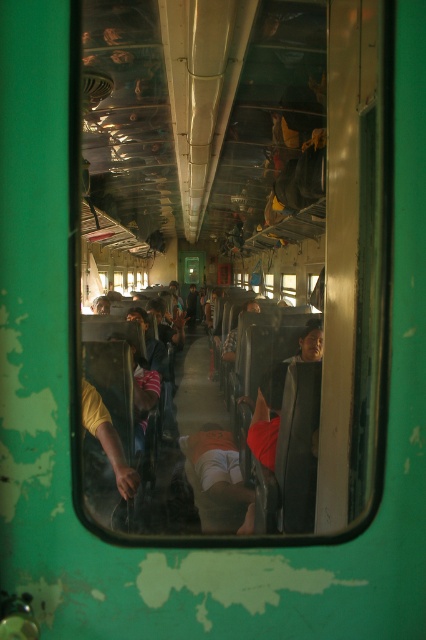
In the scene shown: Does transparent glass window at center lie in front of orange fabric shirt at center?

Yes, it is in front of orange fabric shirt at center.

Which is more to the right, transparent glass window at center or orange fabric shirt at center?

Positioned to the right is transparent glass window at center.

What do you see at coordinates (287, 289) in the screenshot? This screenshot has height=640, width=426. I see `transparent glass window at center` at bounding box center [287, 289].

Identify the location of transparent glass window at center. The width and height of the screenshot is (426, 640). (287, 289).

Who is positioned more to the left, transparent glass train window at center or transparent glass window at center?

transparent glass train window at center is more to the left.

Which is behind, point (239, 177) or point (284, 285)?

The point (284, 285) is more distant.

Between point (209, 109) and point (284, 301), which one is positioned behind?

Positioned behind is point (284, 301).

Find the location of a particular element. transparent glass train window at center is located at coordinates (236, 253).

The width and height of the screenshot is (426, 640). Describe the element at coordinates (236, 253) in the screenshot. I see `transparent glass train window at center` at that location.

Is point (265, 102) positioned before point (187, 294)?

Yes, point (265, 102) is in front of point (187, 294).

Locate an element on the screen. This screenshot has width=426, height=640. transparent glass train window at center is located at coordinates (236, 253).